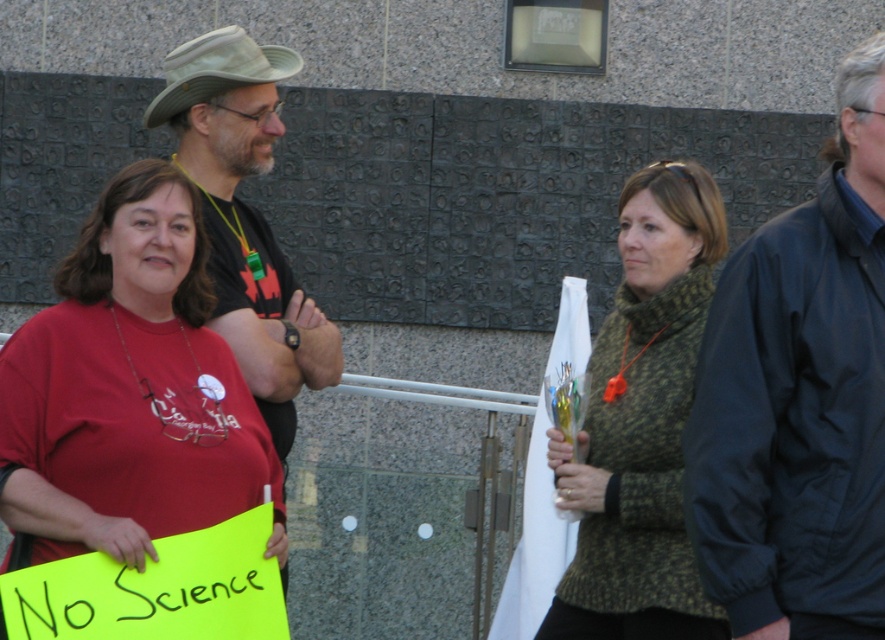
Which is behind, point (239, 100) or point (52, 570)?

Positioned behind is point (239, 100).

Is matte black shirt at center further to camera compared to yellow paper sign at lower left?

Yes, matte black shirt at center is behind yellow paper sign at lower left.

Is point (240, 337) closer to viewer compared to point (252, 589)?

No, it is behind (252, 589).

The height and width of the screenshot is (640, 885). In order to click on matte black shirt at center in this screenshot , I will do `click(245, 218)`.

Does matte red t-shirt at center lie in front of green fabric hat at upper center?

Yes.

Does matte red t-shirt at center appear under green fabric hat at upper center?

Yes.

Describe the element at coordinates (127, 388) in the screenshot. I see `matte red t-shirt at center` at that location.

Find the location of a particular element. This screenshot has width=885, height=640. matte red t-shirt at center is located at coordinates (127, 388).

Which of these two, dark blue jacket at right or matte red t-shirt at center, stands taller?

With more height is dark blue jacket at right.

Is point (743, 452) positioned before point (195, 376)?

Yes, point (743, 452) is in front of point (195, 376).

Who is more distant from viewer, (x=785, y=561) or (x=48, y=317)?

The point (x=48, y=317) is behind.

Find the location of a particular element. This screenshot has width=885, height=640. dark blue jacket at right is located at coordinates (799, 400).